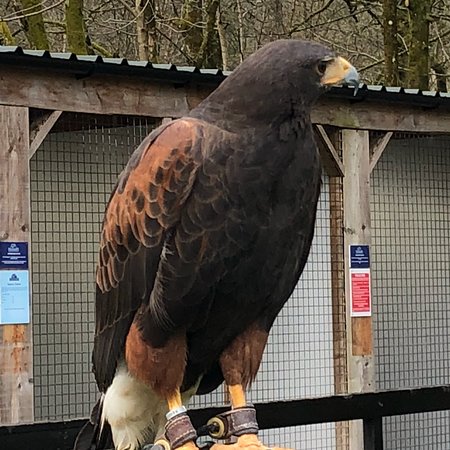
I want to click on grate, so click(324, 370).